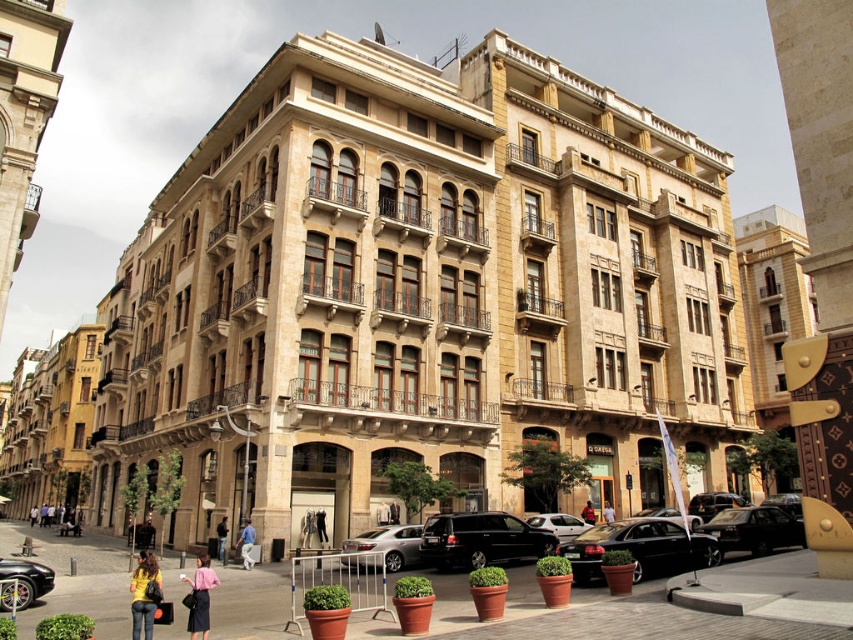
Question: Among these points, which one is nearest to the camera?

Choices:
 (A) (368, 561)
 (B) (225, 515)

Answer: (A)

Question: Can you confirm if shiny black suv at center is wider than shiny black car at lower left?

Choices:
 (A) no
 (B) yes

Answer: (B)

Question: Which of these objects is positioned farthest from the white matte car at center?

Choices:
 (A) shiny black suv at center
 (B) matte black jacket at center
 (C) fur coat at center

Answer: (C)

Question: Can you confirm if white matte car at center is thinner than denim jacket at center?

Choices:
 (A) yes
 (B) no

Answer: (B)

Question: Which point is farther from the camera taking this photo?

Choices:
 (A) (224, 545)
 (B) (610, 509)
 (C) (315, 516)
 (D) (138, 595)

Answer: (B)

Question: Is shiny black car at lower left bigger than blue jeans at lower center?

Choices:
 (A) no
 (B) yes

Answer: (A)